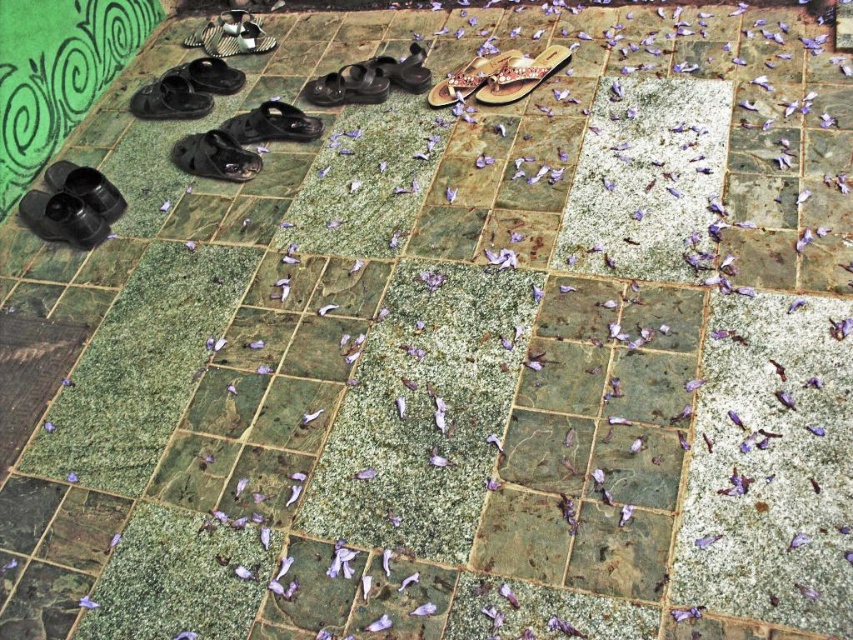
Is point (281, 134) behind point (482, 99)?

Yes, point (281, 134) is behind point (482, 99).

What do you see at coordinates (271, 124) in the screenshot? This screenshot has width=853, height=640. I see `matte black sandal at center` at bounding box center [271, 124].

You are a GUI agent. You are given a task and a screenshot of the screen. Output one action in this format:
    pyautogui.click(x=<x>, y=<y>)
    Task: Click on the matte black sandal at center
    This screenshot has width=853, height=640.
    Given the screenshot: What is the action you would take?
    pyautogui.click(x=271, y=124)

Is shiny black shoe at bottom left taller than beige textured slipper at center?

In fact, shiny black shoe at bottom left may be shorter than beige textured slipper at center.

Can you confirm if shiny black shoe at bottom left is positioned to the left of beige textured slipper at center?

Correct, you'll find shiny black shoe at bottom left to the left of beige textured slipper at center.

Who is more forward, (71, 200) or (457, 86)?

Point (71, 200) is more forward.

At what (x,y) coordinates should I click in order to perform the action: click on shiny black shoe at bottom left. Please return your answer as a coordinate pair (x, y). The width and height of the screenshot is (853, 640). Looking at the image, I should click on (62, 218).

Is black matte shoe at center below black matte shoe at upper left?

Indeed, black matte shoe at center is positioned under black matte shoe at upper left.

This screenshot has width=853, height=640. What do you see at coordinates (213, 156) in the screenshot?
I see `black matte shoe at center` at bounding box center [213, 156].

Who is more distant from viewer, (183, 166) or (212, 58)?

The point (212, 58) is behind.

You are a GUI agent. You are given a task and a screenshot of the screen. Output one action in this format:
    pyautogui.click(x=<x>, y=<y>)
    Task: Click on the black matte shoe at center
    Image resolution: width=853 pixels, height=640 pixels.
    Given the screenshot: What is the action you would take?
    pyautogui.click(x=213, y=156)